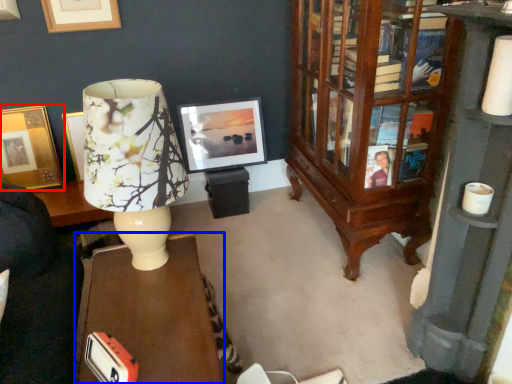
Question: Which object is further to the camera taking this photo, picture frame (highlighted by a red box) or desk (highlighted by a blue box)?

Choices:
 (A) picture frame
 (B) desk

Answer: (A)